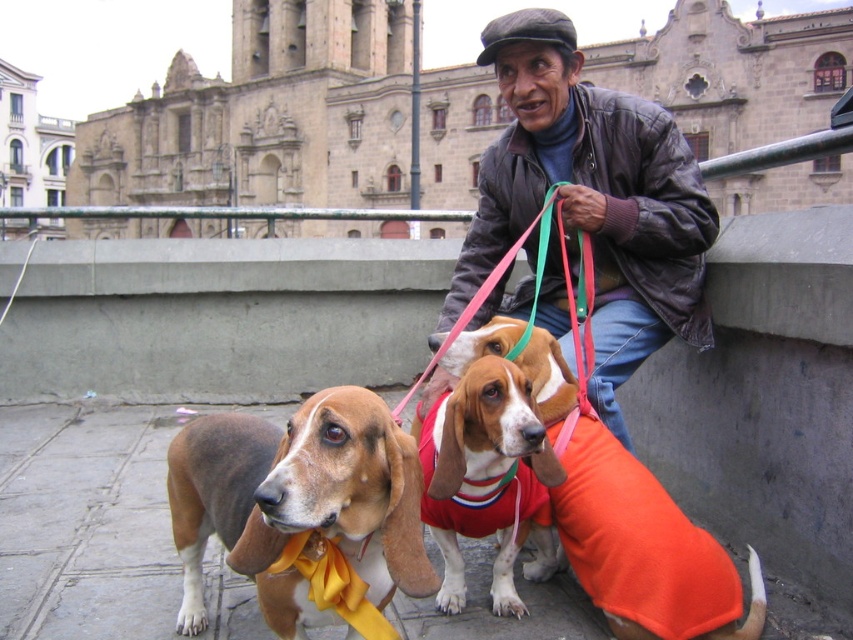
Which of these two, leather jacket at center or brown soft fabric dog at center, stands taller?

leather jacket at center is taller.

Locate an element on the screen. Image resolution: width=853 pixels, height=640 pixels. leather jacket at center is located at coordinates (592, 198).

What are the coordinates of `leather jacket at center` in the screenshot? It's located at (592, 198).

Image resolution: width=853 pixels, height=640 pixels. I want to click on leather jacket at center, so click(x=592, y=198).

Who is more forward, (x=555, y=320) or (x=627, y=464)?

Positioned in front is point (x=627, y=464).

Is point (421, 406) more distant than point (625, 572)?

That is True.

Identify the location of leather jacket at center. (592, 198).

Between orange fleece sweater at center and brown and white fur at center, which one is positioned lower?

Positioned lower is brown and white fur at center.

Does orange fleece sweater at center come behind brown and white fur at center?

That is True.

Who is more distant from viewer, (x=614, y=596) or (x=515, y=481)?

Positioned behind is point (x=515, y=481).

The height and width of the screenshot is (640, 853). I want to click on orange fleece sweater at center, so click(643, 547).